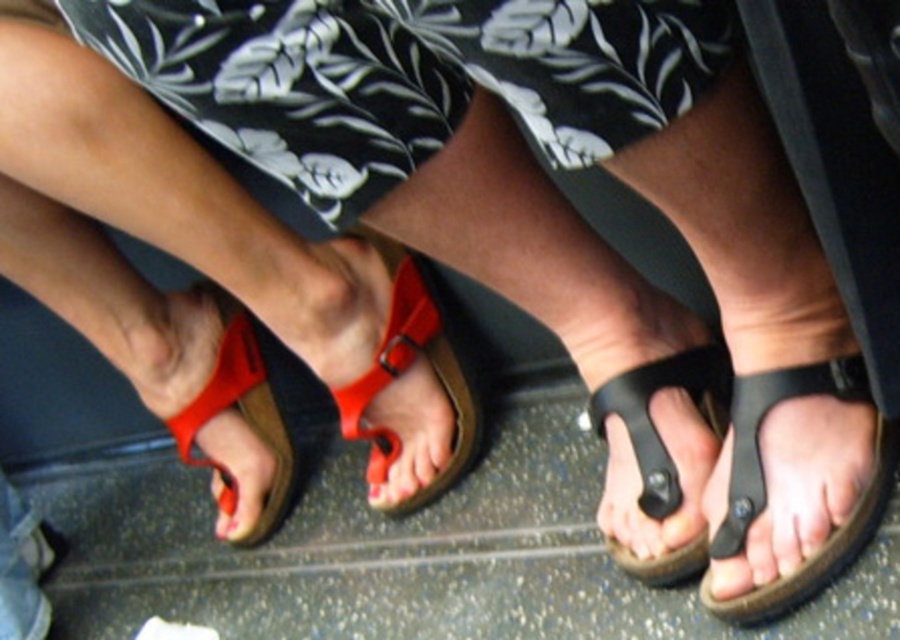
You are standing in a room with a textured dark gray floor. You see two pairs of feet wearing flip flops positioned side by side. The left pair has red flip flops with a buckle, and the right pair has black flip flops with a similar design. There is a point marked at coordinates (659, 458). Which object is located at this point?

The point at (659, 458) marks the location of the black rubber sandal at center.

You are a photographer trying to capture the black floral fabric at center in the scene. The camera is 20.94 inches away from the fabric. If the camera can focus on objects within 20 inches, will it be able to capture the fabric clearly?

The black floral fabric at center is 20.94 inches away from the camera, which is slightly beyond the camera focus range of 20 inches. Therefore, the camera may not capture the fabric clearly.